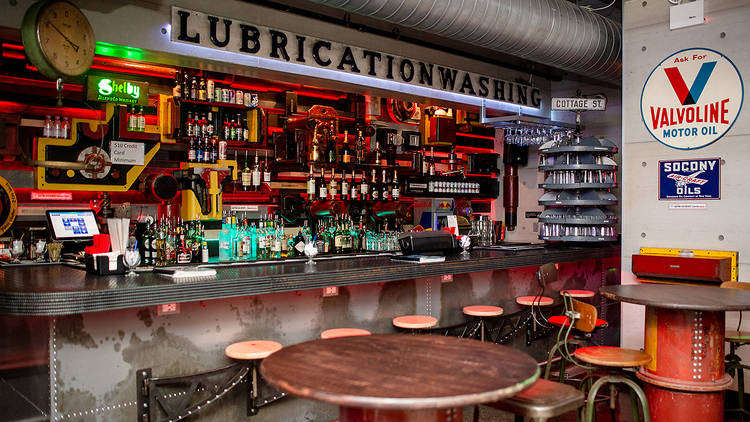
In order to click on stool for table in this screenshot , I will do `click(549, 403)`, `click(613, 356)`, `click(733, 338)`.